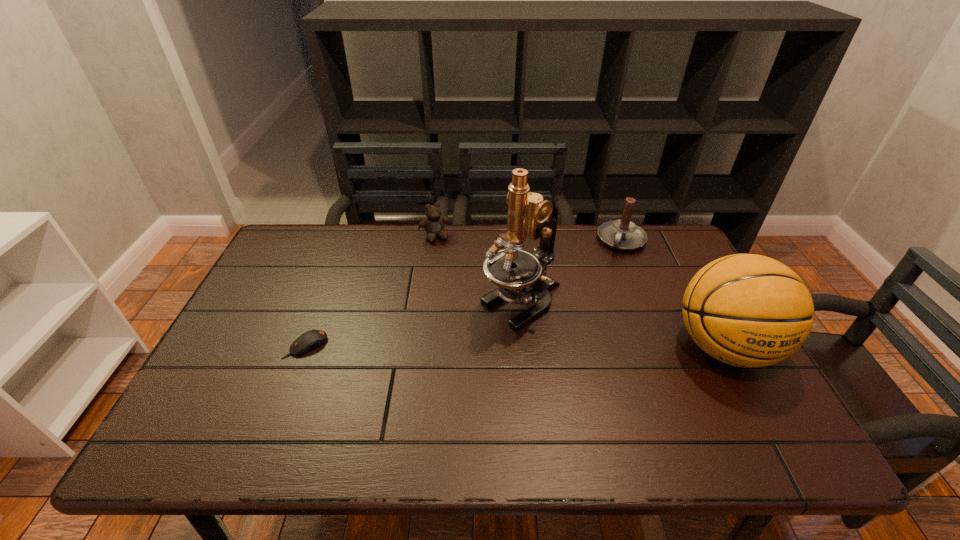
Find the location of a particular element. The height and width of the screenshot is (540, 960). the leftmost object is located at coordinates (311, 339).

Locate an element on the screen. The width and height of the screenshot is (960, 540). the shortest object is located at coordinates (311, 339).

This screenshot has width=960, height=540. In order to click on basketball in this screenshot , I will do `click(746, 310)`.

I want to click on teddy bear, so click(434, 223).

The width and height of the screenshot is (960, 540). In order to click on the fourth tallest object in this screenshot , I will do `click(434, 223)`.

At what (x,y) coordinates should I click in order to perform the action: click on the third tallest object. Please return your answer as a coordinate pair (x, y). The image size is (960, 540). Looking at the image, I should click on (622, 234).

At what (x,y) coordinates should I click in order to perform the action: click on microscope. Please return your answer as a coordinate pair (x, y). The height and width of the screenshot is (540, 960). Looking at the image, I should click on (521, 276).

You are a GUI agent. You are given a task and a screenshot of the screen. Output one action in this format:
    pyautogui.click(x=<x>, y=<y>)
    Task: Click on the third object from left to right
    This screenshot has width=960, height=540.
    Given the screenshot: What is the action you would take?
    pyautogui.click(x=521, y=276)

Where is `vacant position located on the back of the computer mouse`? This screenshot has width=960, height=540. vacant position located on the back of the computer mouse is located at coordinates (x=343, y=249).

In order to click on vacant space located 0.320m on the face of the fourth tallest object in this screenshot , I will do `click(470, 308)`.